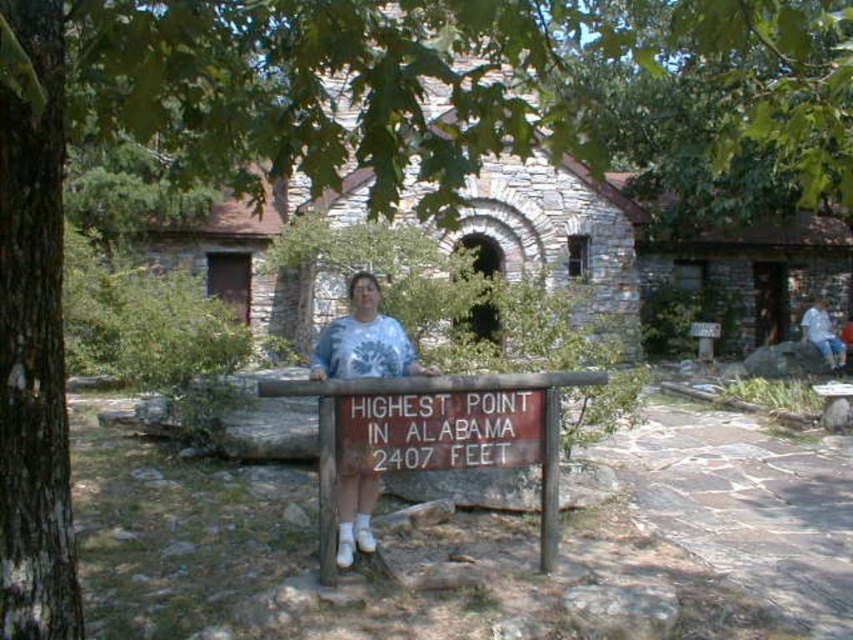
Which of these two, white tie-dye shirt at center or blue denim jeans at right, stands taller?

Standing taller between the two is white tie-dye shirt at center.

Does point (363, 360) come in front of point (828, 340)?

That is True.

Is point (352, 323) positioned before point (805, 321)?

Yes, point (352, 323) is closer to viewer.

Image resolution: width=853 pixels, height=640 pixels. In order to click on white tie-dye shirt at center in this screenshot , I will do `click(364, 339)`.

What are the coordinates of `brown wooden sign at center` in the screenshot? It's located at (439, 429).

Describe the element at coordinates (439, 429) in the screenshot. I see `brown wooden sign at center` at that location.

Image resolution: width=853 pixels, height=640 pixels. I want to click on brown wooden sign at center, so click(x=439, y=429).

Who is lower down, brown wooden sign at center or white tie-dye shirt at center?

brown wooden sign at center is below.

Does point (488, 458) lie behind point (350, 472)?

Yes, point (488, 458) is behind point (350, 472).

This screenshot has width=853, height=640. I want to click on brown wooden sign at center, so click(x=439, y=429).